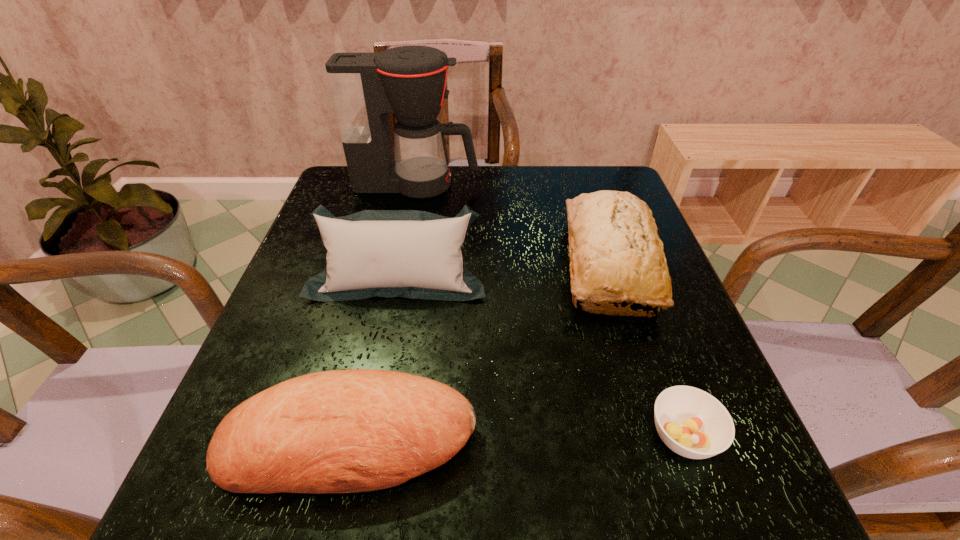
Choose which object is the nearest neighbor to the soup bowl. Please provide its 2D coordinates. Your answer should be formatted as a tuple, i.e. [(x, y)], where the tuple contains the x and y coordinates of a point satisfying the conditions above.

[(613, 242)]

Select which object appears as the fourth closest to the cushion. Please provide its 2D coordinates. Your answer should be formatted as a tuple, i.e. [(x, y)], where the tuple contains the x and y coordinates of a point satisfying the conditions above.

[(691, 422)]

Identify the location of free space in the image that satisfies the following two spatial constraints: 1. pour from the carafe of the coffee maker; 2. on the surface of the cushion. This screenshot has width=960, height=540. (398, 278).

Find the location of a particular element. This screenshot has height=540, width=960. vacant region that satisfies the following two spatial constraints: 1. pour from the carafe of the tallest object; 2. on the surface of the cushion is located at coordinates (398, 278).

Find the location of a particular element. Image resolution: width=960 pixels, height=540 pixels. vacant space that satisfies the following two spatial constraints: 1. pour from the carafe of the farther bread; 2. on the right side of the farthest object is located at coordinates (401, 264).

I want to click on blank space that satisfies the following two spatial constraints: 1. on the back side of the shortest object; 2. pour from the carafe of the tallest object, so click(593, 185).

Where is `vacant space that satisfies the following two spatial constraints: 1. pour from the carafe of the coffee maker; 2. on the surface of the cushion`? vacant space that satisfies the following two spatial constraints: 1. pour from the carafe of the coffee maker; 2. on the surface of the cushion is located at coordinates (398, 278).

Image resolution: width=960 pixels, height=540 pixels. Find the location of `free space that satisfies the following two spatial constraints: 1. pour from the carafe of the coffee maker; 2. on the surface of the cushion`. free space that satisfies the following two spatial constraints: 1. pour from the carafe of the coffee maker; 2. on the surface of the cushion is located at coordinates (398, 278).